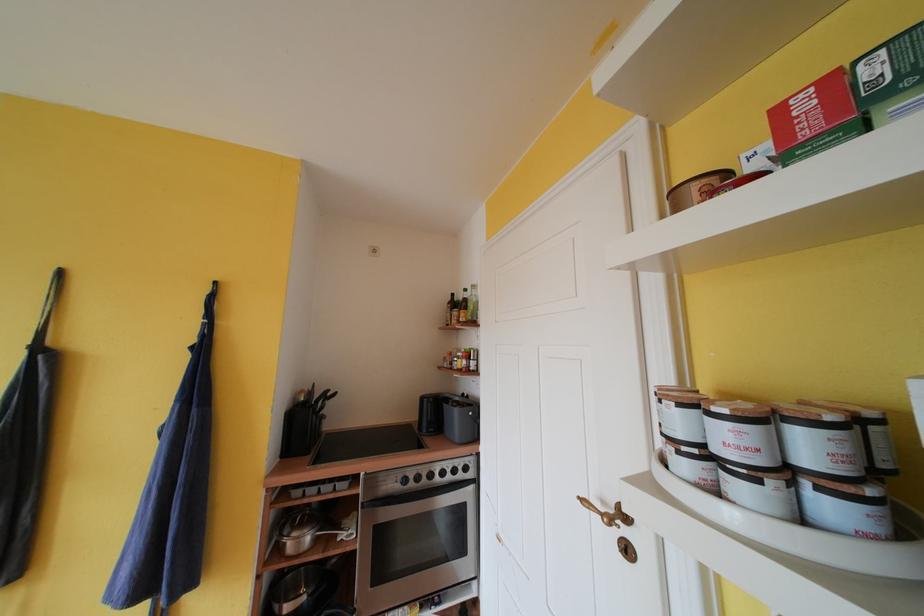
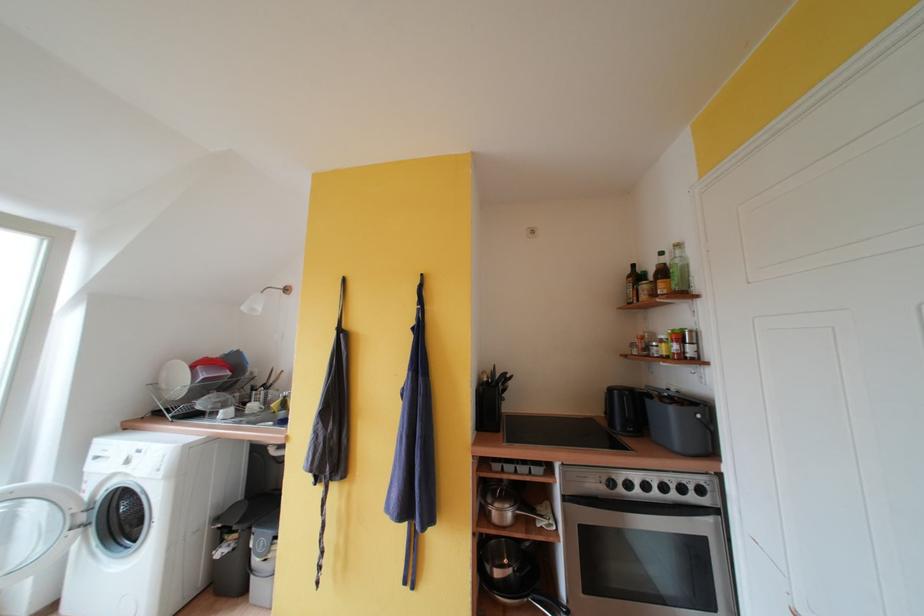
Find the pixel in the second image that matches the point at 293,535 in the first image.

(495, 504)